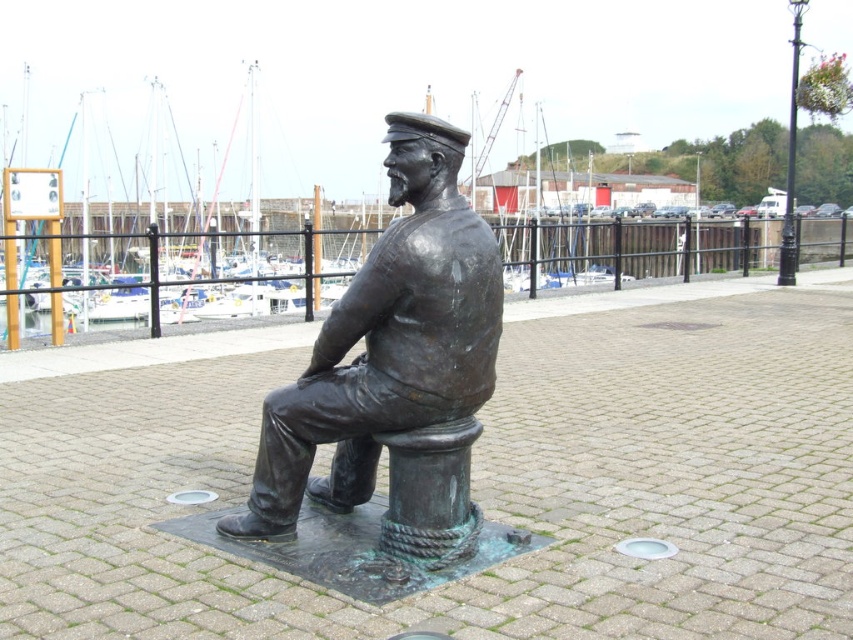
Is bronze statue at center positioned in front of black wrought iron pole at upper right?

Yes, bronze statue at center is closer to the viewer.

Who is positioned more to the right, bronze statue at center or black wrought iron pole at upper right?

Positioned to the right is black wrought iron pole at upper right.

What do you see at coordinates (386, 340) in the screenshot?
I see `bronze statue at center` at bounding box center [386, 340].

This screenshot has width=853, height=640. Find the location of `bronze statue at center`. bronze statue at center is located at coordinates (386, 340).